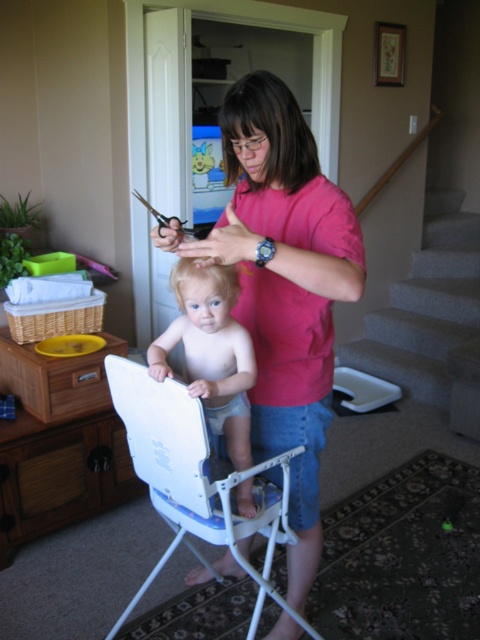
You are a parent trying to reach the metallic scissors at upper center while holding your child in the light brown plastic high chair at center. Can you safely grab the scissors without moving the chair?

The light brown plastic high chair at center is 17.24 inches away from the metallic scissors at upper center. Since the distance is relatively short, you can likely safely reach the scissors without needing to move the chair, provided your arm length allows.

You are a parent trying to organize your home. You have a light brown plastic high chair at center and metallic scissors at upper center. Which object should you move first if you want to create space between them?

You should move the light brown plastic high chair at center first because it is to the right of the metallic scissors at upper center, so moving it away would create space between them.